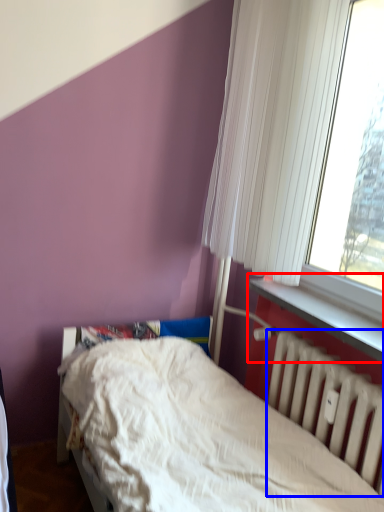
Question: Which object is further to the camera taking this photo, window sill (highlighted by a red box) or radiator (highlighted by a blue box)?

Choices:
 (A) window sill
 (B) radiator

Answer: (A)